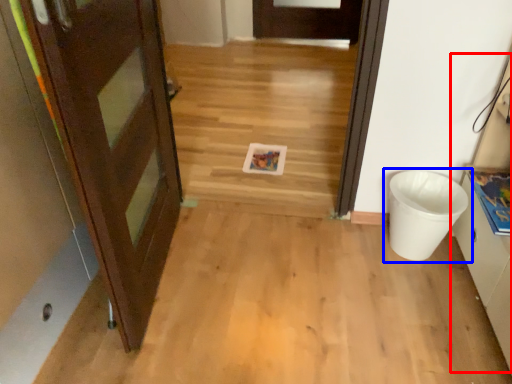
Question: Which point is further to the camera, cabinetry (highlighted by a red box) or waste container (highlighted by a blue box)?

Choices:
 (A) cabinetry
 (B) waste container

Answer: (B)